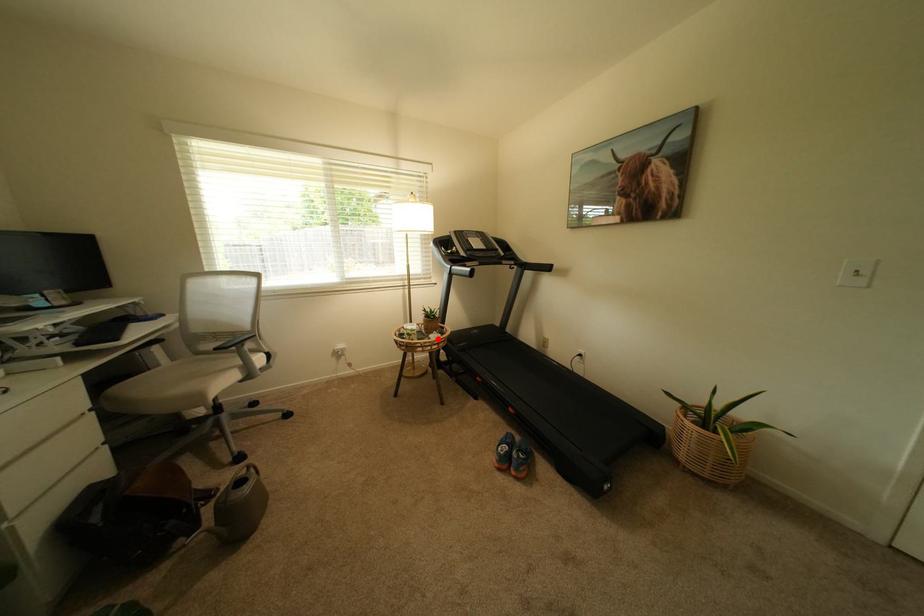
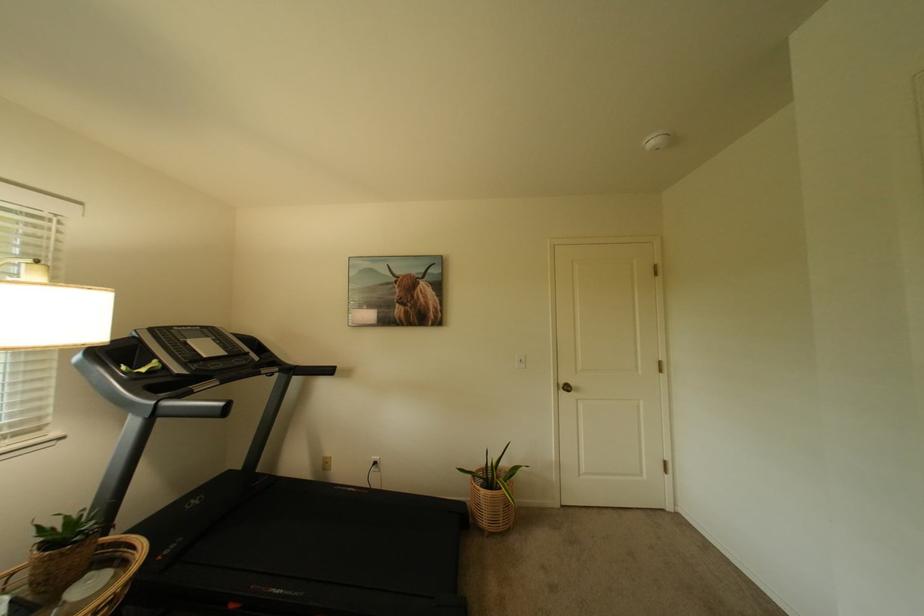
Find the pixel in the second image that matches the highlighted location in the first image.

(73, 605)